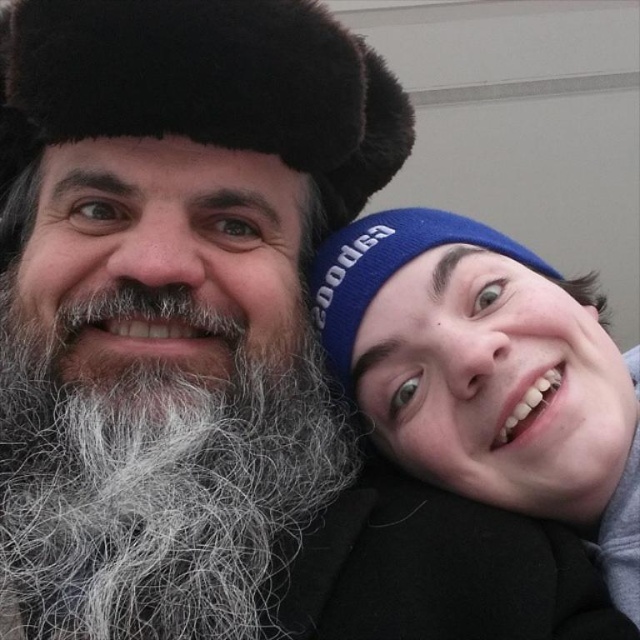
Is gray fluffy beard at left taller than blue knit cap at upper right?

Incorrect, gray fluffy beard at left's height is not larger of blue knit cap at upper right's.

Is gray fluffy beard at left below blue knit cap at upper right?

Yes, gray fluffy beard at left is below blue knit cap at upper right.

Measure the distance between point (97,397) and camera.

They are 95.13 centimeters apart.

Identify the location of gray fluffy beard at left. (157, 490).

Is point (531, 285) closer to camera compared to point (385, 227)?

Yes, it is in front of point (385, 227).

Does blue knit cap at upper right appear on the right side of blue knit cap at right?

Yes, blue knit cap at upper right is to the right of blue knit cap at right.

You are a GUI agent. You are given a task and a screenshot of the screen. Output one action in this format:
    pyautogui.click(x=<x>, y=<y>)
    Task: Click on the blue knit cap at upper right
    
    Given the screenshot: What is the action you would take?
    pyautogui.click(x=486, y=372)

Between fuzzy fur hat at upper left and blue knit cap at right, which one has less height?

blue knit cap at right is shorter.

Is fuzzy fur hat at upper left smaller than blue knit cap at right?

No.

Locate an element on the screen. fuzzy fur hat at upper left is located at coordinates (204, 84).